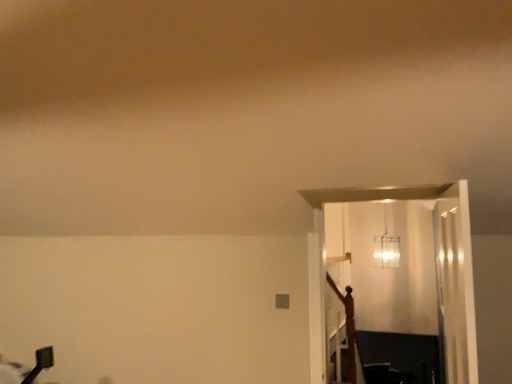
Question: From a real-world perspective, is translucent glass pendant light at upper center physically located above or below wooden crucifix at right?

Choices:
 (A) below
 (B) above

Answer: (B)

Question: Considering the positions of translucent glass pendant light at upper center and wooden crucifix at right in the image, is translucent glass pendant light at upper center taller or shorter than wooden crucifix at right?

Choices:
 (A) tall
 (B) short

Answer: (B)

Question: Based on their relative distances, which object is farther from the translucent glass pendant light at upper center?

Choices:
 (A) clear glass door at right
 (B) wooden crucifix at right

Answer: (A)

Question: Based on their relative distances, which object is farther from the wooden crucifix at right?

Choices:
 (A) clear glass door at right
 (B) translucent glass pendant light at upper center

Answer: (B)